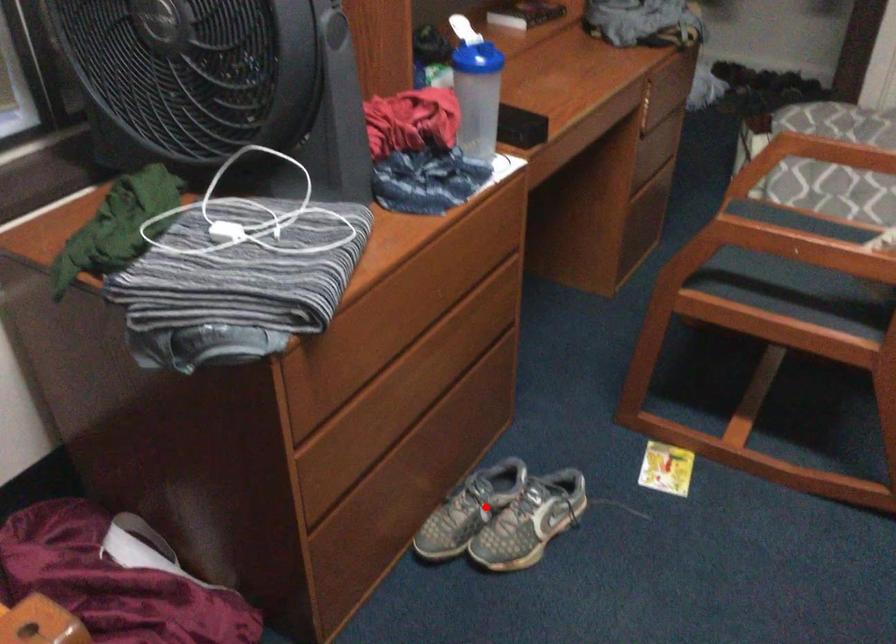
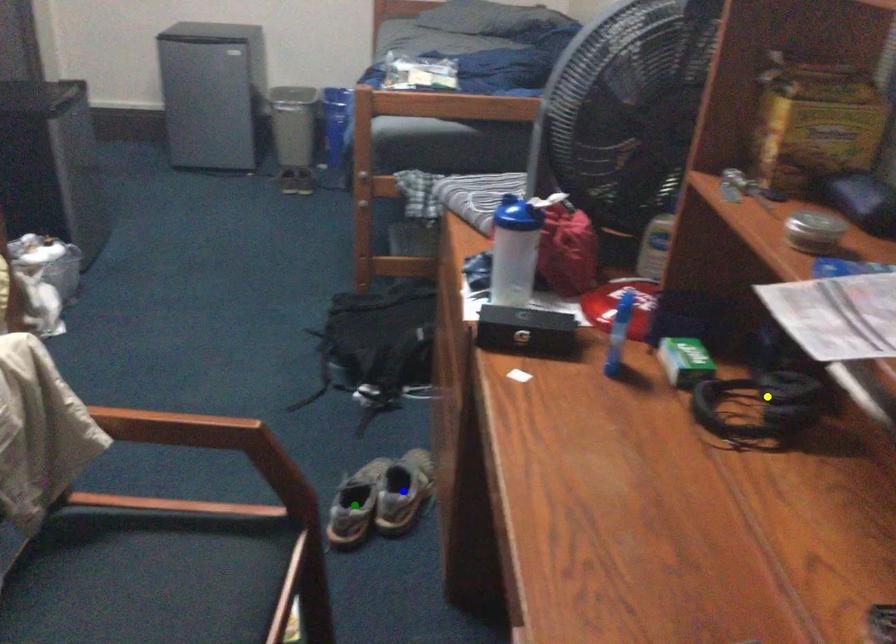
Question: I am providing you with two images of the same scene from different viewpoints. A red point is marked on the first image. You are given multiple points on the second image. Which mark in image 2 goes with the point in image 1?

Choices:
 (A) yellow point
 (B) green point
 (C) blue point

Answer: (C)